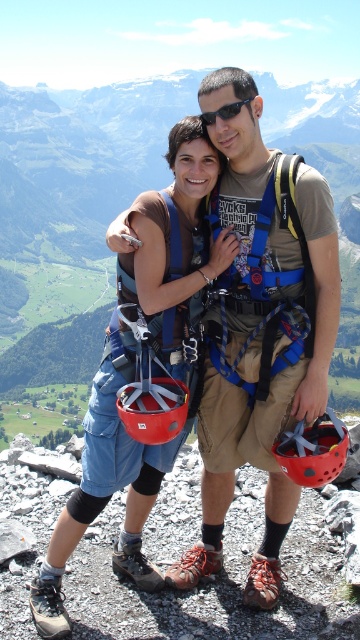
Can you confirm if matte red helmet at center is bigger than black plastic sunglasses at center?

Correct, matte red helmet at center is larger in size than black plastic sunglasses at center.

At what (x,y) coordinates should I click in order to perform the action: click on matte red helmet at center. Please return your answer as a coordinate pair (x, y). Looking at the image, I should click on (153, 408).

Can you confirm if matte orange helmet at center is positioned below black plastic sunglasses at center?

Yes.

Is point (317, 435) less distant than point (231, 104)?

Yes, point (317, 435) is in front of point (231, 104).

I want to click on matte orange helmet at center, so click(x=313, y=451).

Is matte orange helmet at center taller than matte red helmet at center?

Indeed, matte orange helmet at center has a greater height compared to matte red helmet at center.

What do you see at coordinates (313, 451) in the screenshot?
I see `matte orange helmet at center` at bounding box center [313, 451].

Locate an element on the screen. The image size is (360, 640). matte orange helmet at center is located at coordinates coord(313,451).